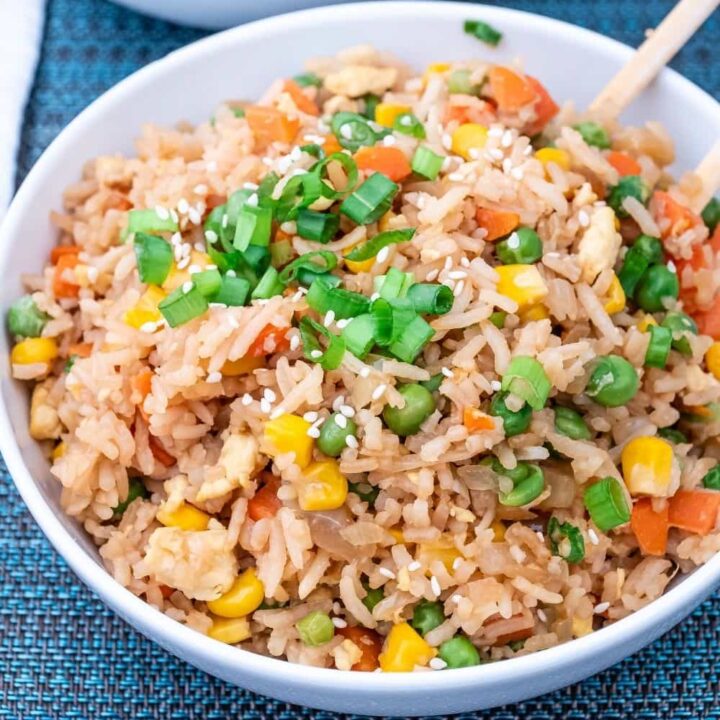
Locate an element on the screen. blue placemat is located at coordinates (630, 692).